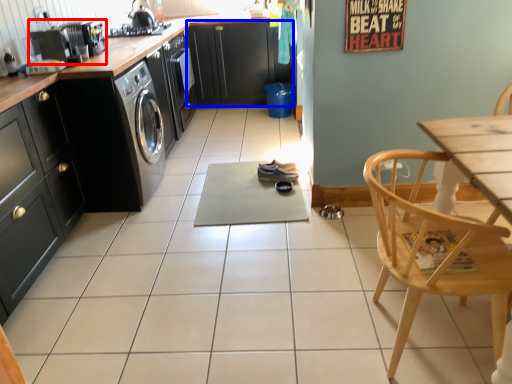
Question: Which point is further to the camera, kitchen appliance (highlighted by a red box) or cabinetry (highlighted by a blue box)?

Choices:
 (A) kitchen appliance
 (B) cabinetry

Answer: (B)